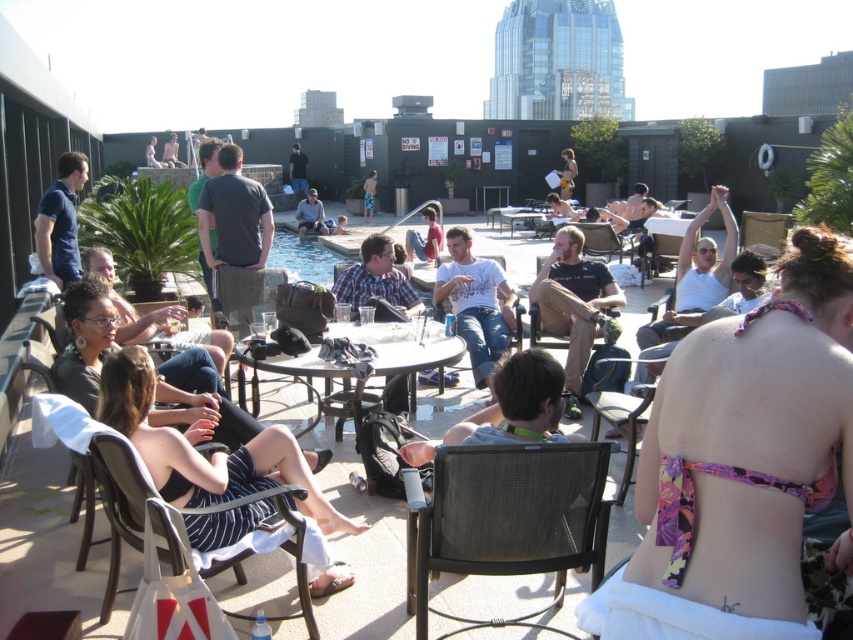
Image resolution: width=853 pixels, height=640 pixels. What do you see at coordinates (508, 518) in the screenshot?
I see `black mesh chair at lower center` at bounding box center [508, 518].

Is point (422, 513) in front of point (300, 582)?

Yes.

Measure the distance between black mesh chair at lower center and camera.

black mesh chair at lower center and camera are 10.43 feet apart from each other.

Locate an element on the screen. black mesh chair at lower center is located at coordinates (508, 518).

Is matte black shirt at center bigger than white cotton shirt at center?

Yes, matte black shirt at center is bigger than white cotton shirt at center.

Who is more distant from viewer, (554, 308) or (451, 278)?

The point (451, 278) is behind.

The height and width of the screenshot is (640, 853). Find the location of `matte black shirt at center`. matte black shirt at center is located at coordinates pos(573,305).

Does striped fabric dress at center appear over white cotton shirt at center?

No.

Who is taller, striped fabric dress at center or white cotton shirt at center?

white cotton shirt at center is taller.

Who is more distant from viewer, (235, 465) or (459, 237)?

The point (459, 237) is behind.

Find the location of `striped fabric dress at center`. striped fabric dress at center is located at coordinates (199, 451).